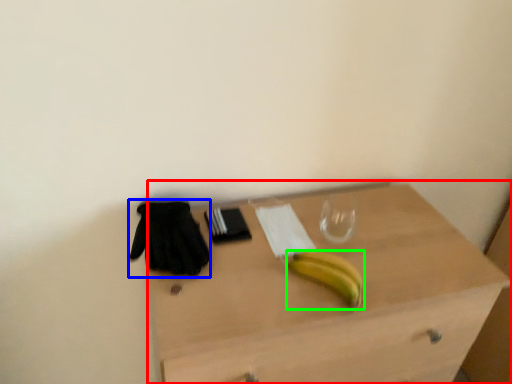
Question: Based on their relative distances, which object is nearer to desk (highlighted by a red box)? Choose from glove (highlighted by a blue box) and banana (highlighted by a green box).

Choices:
 (A) glove
 (B) banana

Answer: (B)